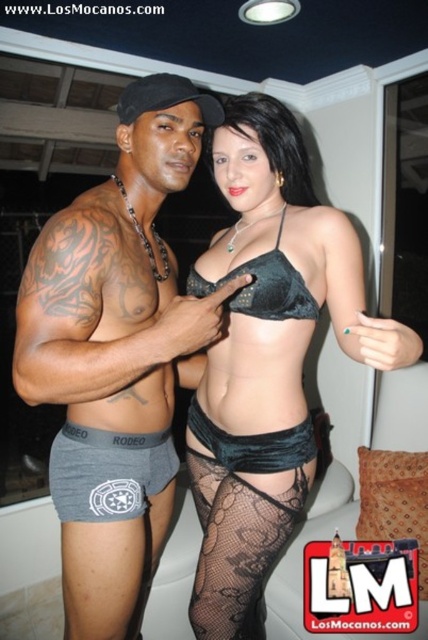
You are a photographer setting up a shoot and need to ensure that both the gray cotton underwear at center and the velvet black lingerie at center are visible in the frame. Based on their positions, which one is closer to the camera?

The gray cotton underwear at center is closer to the camera because it is further to the viewer than the velvet black lingerie at center.

What object is located at the coordinates point (237, 547) in the image?

The coordinates point (237, 547) indicate the location of the black lace stockings at lower center.

Based on the scene description, which clothing item is shorter in height between the gray cotton boxer briefs at lower left and the velvet black bikini top at center?

The gray cotton boxer briefs at lower left is shorter than the velvet black bikini top at center according to the description.